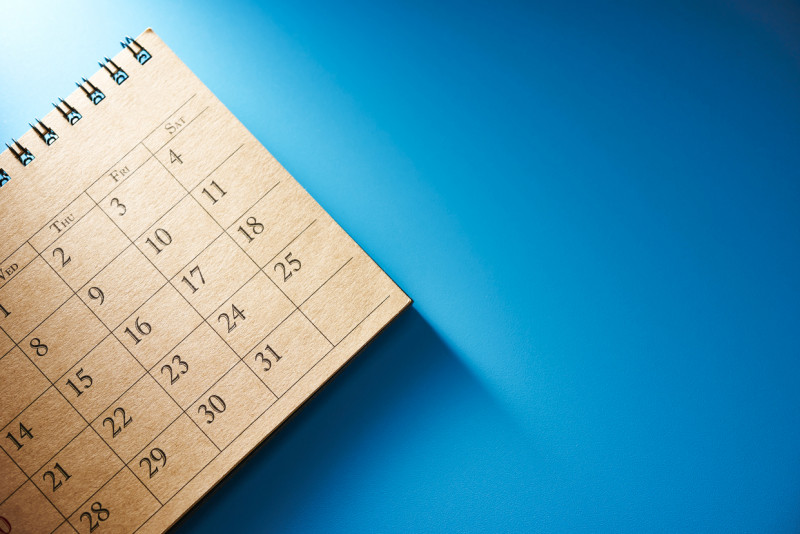
Where is `horizontal lines on the calendar`? The width and height of the screenshot is (800, 534). horizontal lines on the calendar is located at coordinates (76, 198), (88, 214), (110, 262), (144, 299), (178, 340), (217, 383), (260, 416).